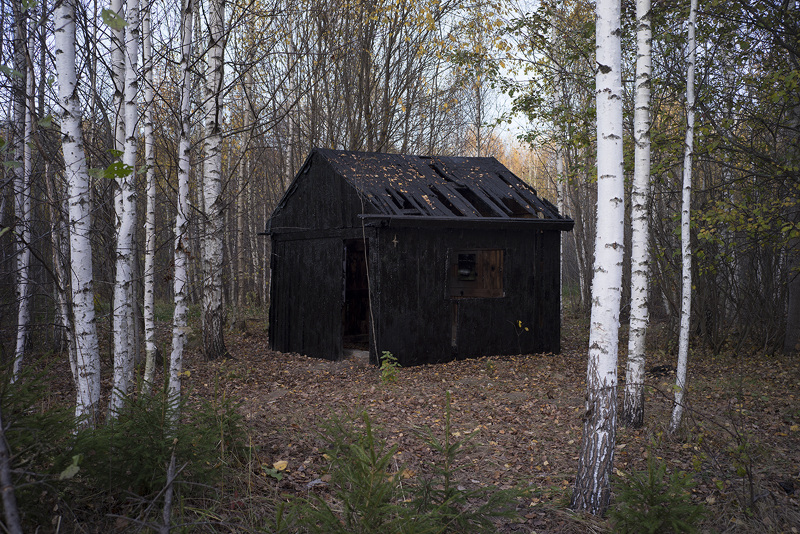
The image size is (800, 534). I want to click on burnt window, so click(x=468, y=282).